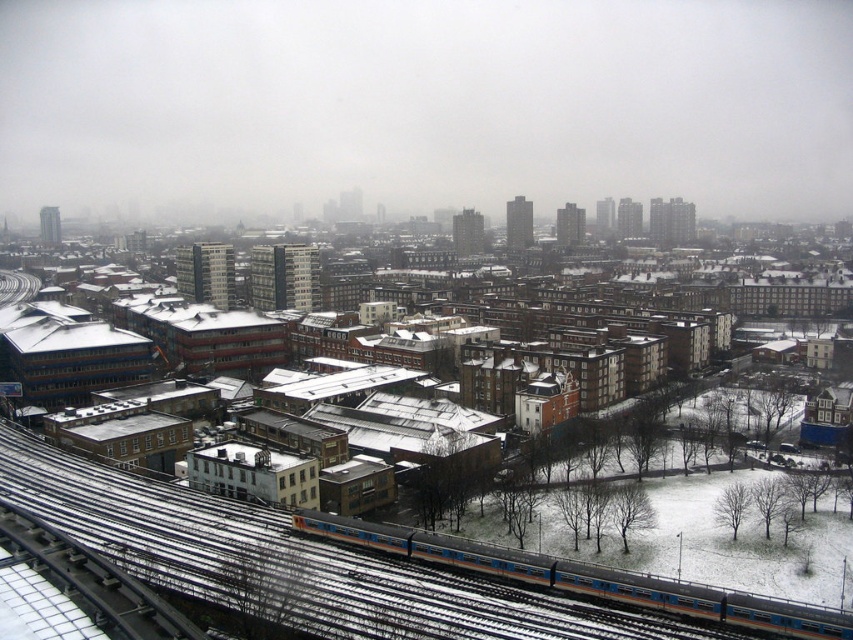
Question: Does blue metallic train at lower center appear over metallic silver train track at lower left?

Choices:
 (A) no
 (B) yes

Answer: (A)

Question: Observing the image, what is the correct spatial positioning of blue metallic train at lower center in reference to metallic silver train track at lower left?

Choices:
 (A) above
 (B) below

Answer: (B)

Question: Does blue metallic train at lower center appear under metallic silver train track at lower left?

Choices:
 (A) yes
 (B) no

Answer: (A)